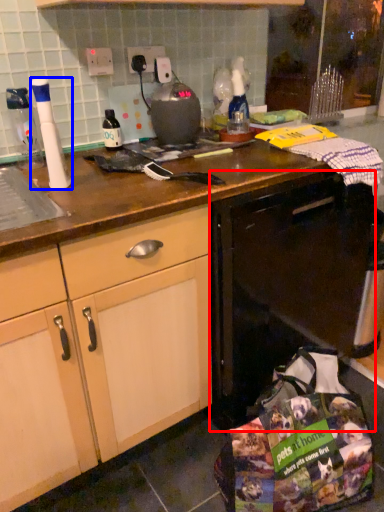
Question: Which object is further to the camera taking this photo, dish washer (highlighted by a red box) or kitchen appliance (highlighted by a blue box)?

Choices:
 (A) dish washer
 (B) kitchen appliance

Answer: (A)